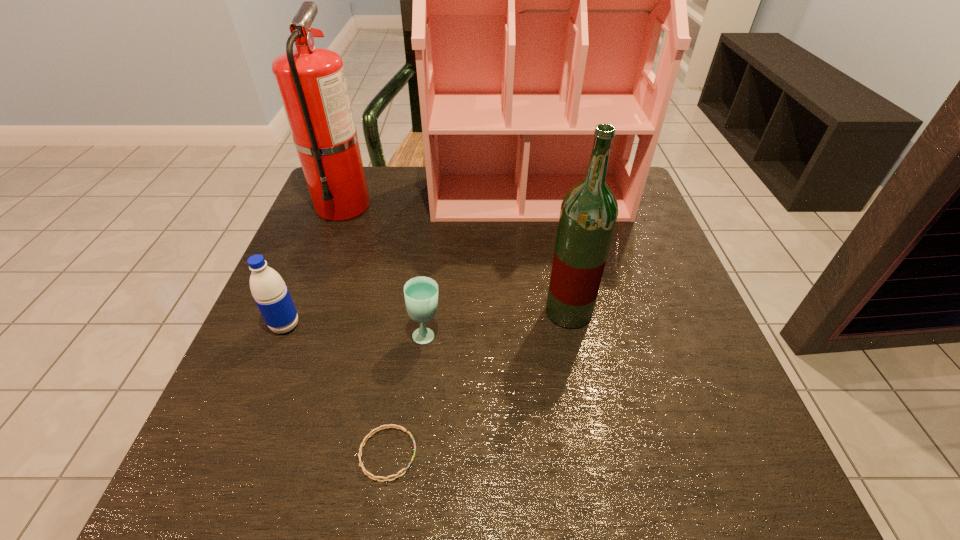
Where is `free spot between the shortest object and the glass`? Image resolution: width=960 pixels, height=540 pixels. free spot between the shortest object and the glass is located at coordinates [407, 394].

Locate an element on the screen. This screenshot has width=960, height=540. unoccupied area between the liquor and the dollhouse is located at coordinates (549, 254).

Find the location of a particular element. The image size is (960, 540). empty space that is in between the liquor and the nearest object is located at coordinates (478, 383).

Find the location of `free space between the dollhouse and the fifth tallest object`. free space between the dollhouse and the fifth tallest object is located at coordinates (478, 266).

Find the location of a particular element. The image size is (960, 540). object that is the third closest to the fire extinguisher is located at coordinates (421, 293).

Locate an element on the screen. object that ranks as the closest to the dollhouse is located at coordinates (311, 82).

Find the location of a particular element. The image size is (960, 540). vacant point that satisfies the following two spatial constraints: 1. at the nozzle of the fire extinguisher; 2. on the left side of the glass is located at coordinates (294, 335).

The image size is (960, 540). In order to click on free space that satisfies the following two spatial constraints: 1. at the nozzle of the liquor; 2. on the left side of the fire extinguisher in this screenshot , I will do `click(302, 312)`.

Identify the location of vacant space that satisfies the following two spatial constraints: 1. on the front-facing side of the dollhouse; 2. on the surface of the nearest object showing star-shaped elements. (565, 454).

At what (x,y) coordinates should I click in order to perform the action: click on vacant point that satisfies the following two spatial constraints: 1. on the front-facing side of the dollhouse; 2. on the surface of the shortest object showing star-shaped elements. Please return your answer as a coordinate pair (x, y). The image size is (960, 540). Looking at the image, I should click on (565, 454).